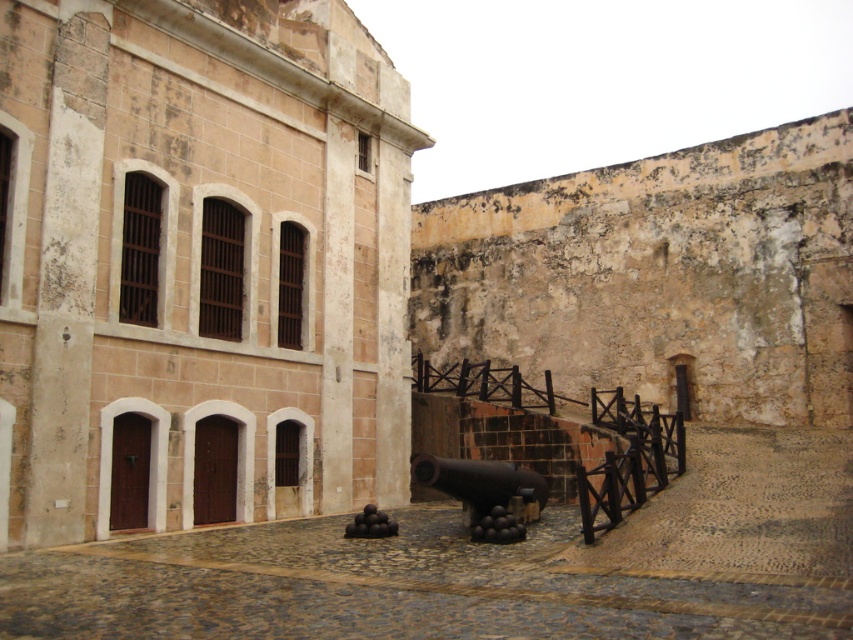
You are standing in the courtyard of the historical fortification. You need to locate the matte stone building at center. According to the coordinates provided, where exactly is it positioned?

The matte stone building at center is located at the coordinates point (198,264).

You are a soldier in a historical fortification. You need to move the black matte cannon at center to the right side of the matte stone building at center. Is the current position of the cannon already on the right side of the building?

The matte stone building at center is positioned on the left side of black matte cannon at center, so the cannon is already on the right side of the matte stone building at center. Therefore, you do not need to move it.

You are standing in the cobblestone courtyard of the historical fortification. You see two points marked on the ground, one at point coordinates point (165, 372) and the other at point (461, 468). Which point is closer to you?

Point (165, 372) is further to the viewer than point (461, 468), so the point closer to you is point (461, 468).